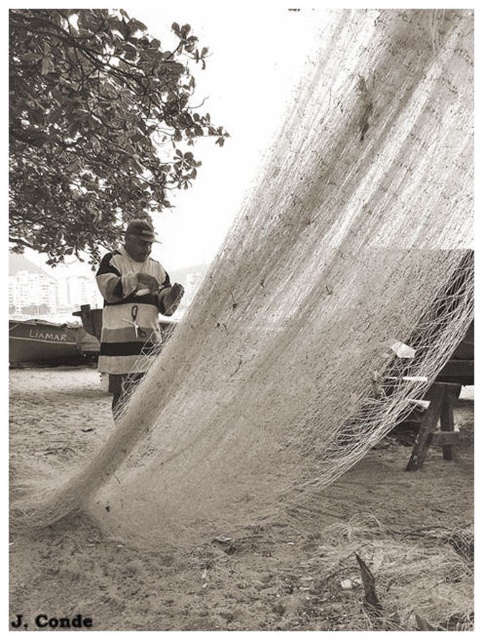
Which is above, striped fabric fisherman at center or brushed metal boat at left?

striped fabric fisherman at center is higher up.

Which is in front, point (117, 324) or point (97, 330)?

Point (117, 324)

What do you see at coordinates (131, 308) in the screenshot? This screenshot has height=640, width=483. I see `striped fabric fisherman at center` at bounding box center [131, 308].

What are the coordinates of `striped fabric fisherman at center` in the screenshot? It's located at (131, 308).